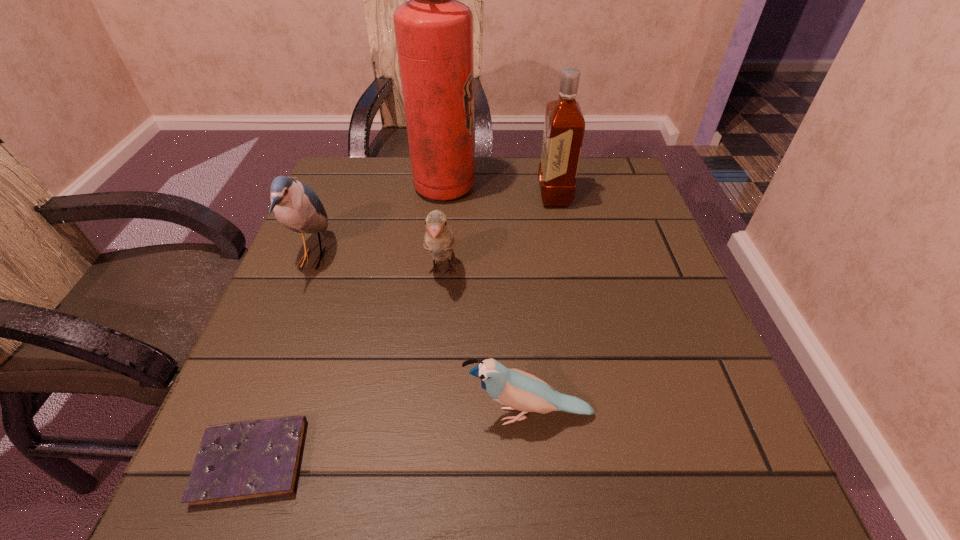
This screenshot has width=960, height=540. In order to click on object that stands as the closest to the liquor in this screenshot , I will do `click(434, 31)`.

Select which object appears as the fifth closest to the diary. Please provide its 2D coordinates. Your answer should be formatted as a tuple, i.e. [(x, y)], where the tuple contains the x and y coordinates of a point satisfying the conditions above.

[(564, 126)]

Find the location of a particular element. bird that can be found as the third closest to the shortest object is located at coordinates (439, 240).

This screenshot has width=960, height=540. I want to click on bird that is the second closest to the leftmost bird, so click(521, 391).

This screenshot has width=960, height=540. What are the coordinates of `free spot that satisfies the following two spatial constraints: 1. on the front label of the liquor; 2. on the front side of the shortest object` in the screenshot? It's located at (609, 461).

Where is `free spot that satisfies the following two spatial constraints: 1. on the back side of the shortest object; 2. at the tip of the tallest bird's beak`? The image size is (960, 540). free spot that satisfies the following two spatial constraints: 1. on the back side of the shortest object; 2. at the tip of the tallest bird's beak is located at coordinates (326, 258).

The height and width of the screenshot is (540, 960). Identify the location of vacant space that satisfies the following two spatial constraints: 1. on the back side of the diary; 2. at the tip of the tallest bird's beak. (326, 258).